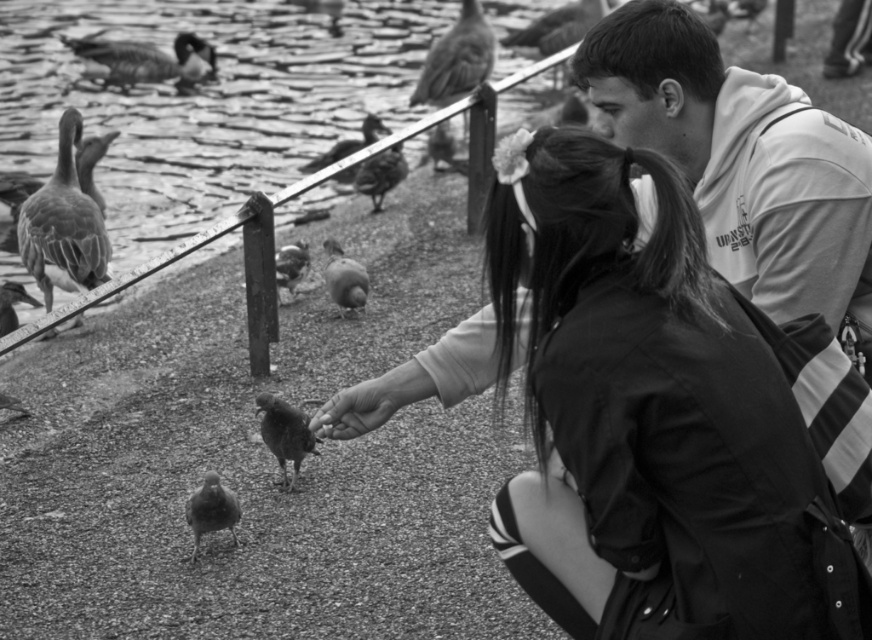
Question: Considering the relative positions of smooth black jacket at center and smooth gray duck at left in the image provided, where is smooth black jacket at center located with respect to smooth gray duck at left?

Choices:
 (A) right
 (B) left

Answer: (A)

Question: Where is smooth gray duck at left located in relation to smooth gray duck at center in the image?

Choices:
 (A) left
 (B) right

Answer: (A)

Question: Estimate the real-world distances between objects in this image. Which object is closer to the feathered brown bird at center?

Choices:
 (A) smooth feathered goose at upper center
 (B) smooth feathered bird at center
 (C) smooth feathered pigeon at lower left

Answer: (C)

Question: Is smooth black jacket at center wider than feathered brown bird at center?

Choices:
 (A) no
 (B) yes

Answer: (B)

Question: Which point is closer to the camera?

Choices:
 (A) white fleece hoodie at upper right
 (B) smooth gray duck at upper left
 (C) smooth feathered pigeon at center
 (D) smooth black jacket at center

Answer: (D)

Question: Estimate the real-world distances between objects in this image. Which object is farther from the smooth feathered bird at center?

Choices:
 (A) smooth gray duck at left
 (B) smooth black jacket at center

Answer: (B)